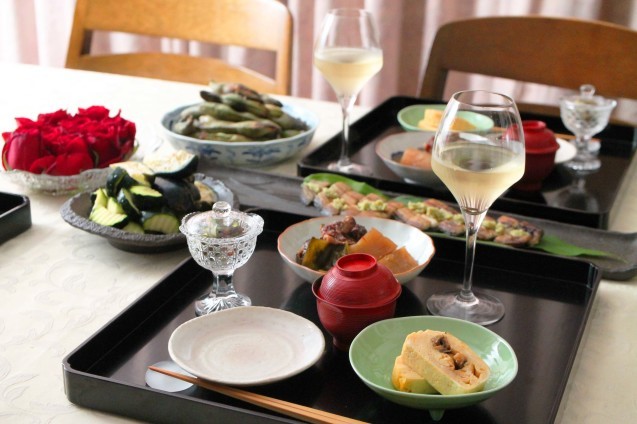
The image size is (637, 424). In order to click on lidded compote dishes in this screenshot , I will do `click(211, 243)`, `click(590, 118)`.